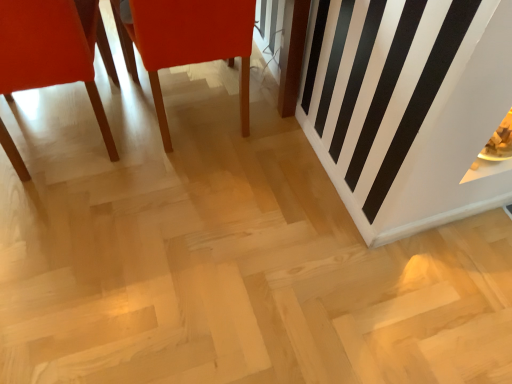
Where is `space that is in front of matte wood chair at center, the 1th chair viewed from the right`? space that is in front of matte wood chair at center, the 1th chair viewed from the right is located at coordinates (181, 215).